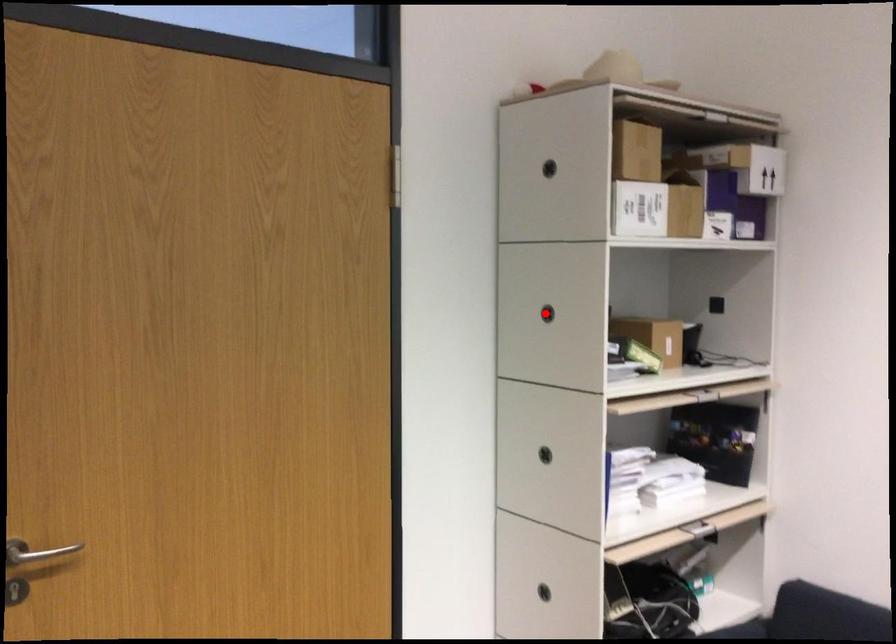
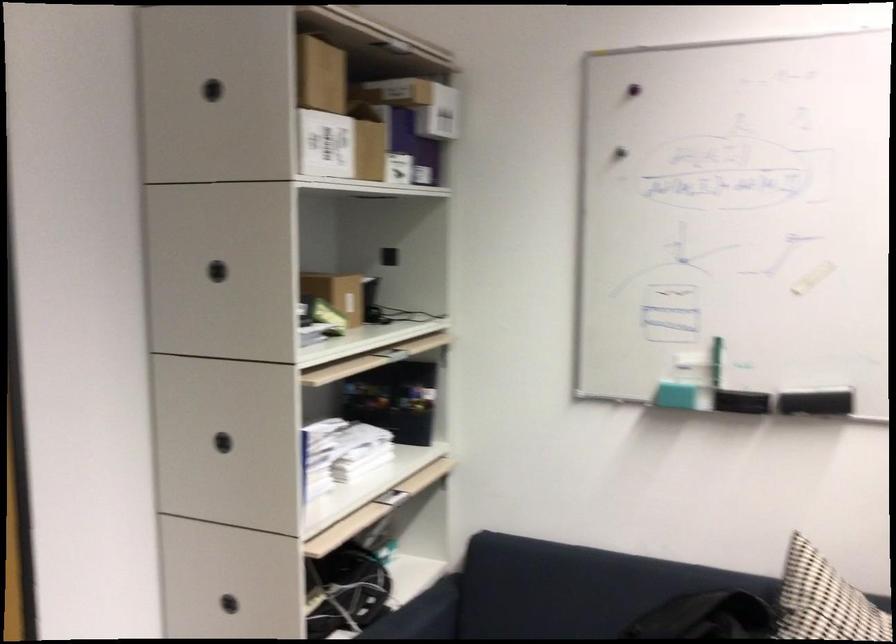
Locate, in the second image, the point that corresponds to the highlighted location in the first image.

(217, 270)